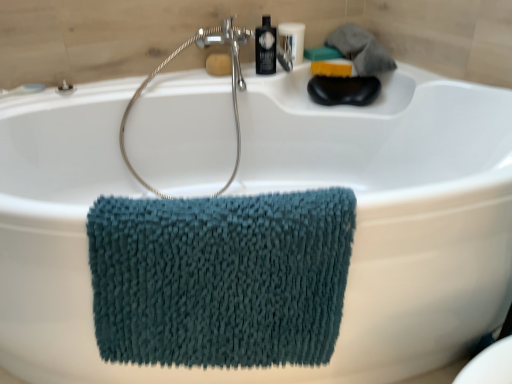
Question: From a real-world perspective, is yellow sponge at upper center, which appears as the first soap when viewed from the left, located higher than teal chenille towel at center?

Choices:
 (A) yes
 (B) no

Answer: (A)

Question: Is yellow sponge at upper center, which appears as the first soap when viewed from the left, taller than teal chenille towel at center?

Choices:
 (A) no
 (B) yes

Answer: (A)

Question: Is yellow sponge at upper center, which appears as the first soap when viewed from the left, far from teal chenille towel at center?

Choices:
 (A) no
 (B) yes

Answer: (B)

Question: Is yellow sponge at upper center, placed as the 2th soap when sorted from right to left, bigger than teal chenille towel at center?

Choices:
 (A) yes
 (B) no

Answer: (B)

Question: From a real-world perspective, is yellow sponge at upper center, which appears as the first soap when viewed from the left, positioned under teal chenille towel at center based on gravity?

Choices:
 (A) yes
 (B) no

Answer: (B)

Question: From a real-world perspective, relative to yellow sponge at upper center, which appears as the first soap when viewed from the left, is black glossy bottle at upper center vertically above or below?

Choices:
 (A) below
 (B) above

Answer: (B)

Question: From the image's perspective, is black glossy bottle at upper center located above or below yellow sponge at upper center, which appears as the first soap when viewed from the left?

Choices:
 (A) below
 (B) above

Answer: (B)

Question: In terms of width, does black glossy bottle at upper center look wider or thinner when compared to yellow sponge at upper center, placed as the 2th soap when sorted from right to left?

Choices:
 (A) wide
 (B) thin

Answer: (A)

Question: Considering the positions of black glossy bottle at upper center and yellow sponge at upper center, placed as the 2th soap when sorted from right to left, in the image, is black glossy bottle at upper center taller or shorter than yellow sponge at upper center, placed as the 2th soap when sorted from right to left,?

Choices:
 (A) short
 (B) tall

Answer: (B)

Question: From a real-world perspective, is satin nickel showerhead at upper center above or below translucent plastic bottle at upper center?

Choices:
 (A) above
 (B) below

Answer: (B)

Question: Considering the positions of satin nickel showerhead at upper center and translucent plastic bottle at upper center in the image, is satin nickel showerhead at upper center taller or shorter than translucent plastic bottle at upper center?

Choices:
 (A) tall
 (B) short

Answer: (A)

Question: From the image's perspective, relative to translucent plastic bottle at upper center, is satin nickel showerhead at upper center above or below?

Choices:
 (A) below
 (B) above

Answer: (A)

Question: Looking at the image, does satin nickel showerhead at upper center seem bigger or smaller compared to translucent plastic bottle at upper center?

Choices:
 (A) small
 (B) big

Answer: (B)

Question: Is point (266, 72) closer or farther from the camera than point (340, 72)?

Choices:
 (A) closer
 (B) farther

Answer: (A)

Question: In terms of width, does black glossy bottle at upper center look wider or thinner when compared to yellow sponge at upper right, which is the first soap from right to left?

Choices:
 (A) wide
 (B) thin

Answer: (B)